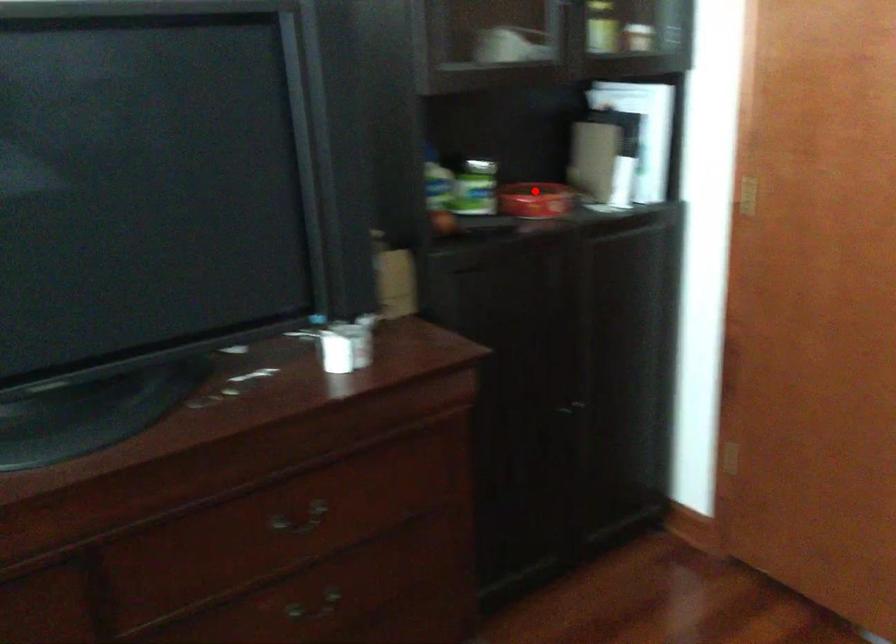
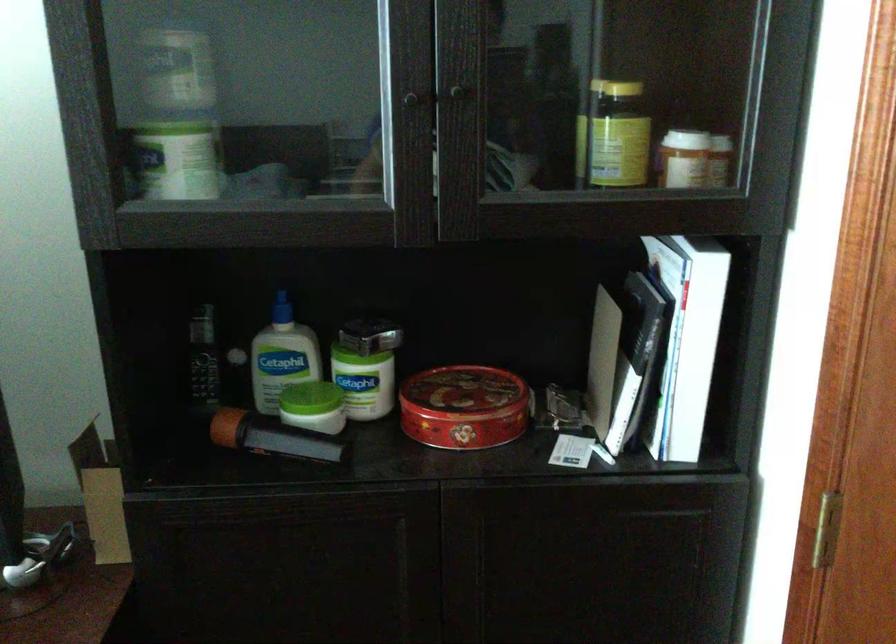
Question: I am providing you with two images of the same scene from different viewpoints. In image1, a red point is highlighted. Considering the same 3D point in image2, which of the following is correct?

Choices:
 (A) It is closer
 (B) It is farther

Answer: (A)